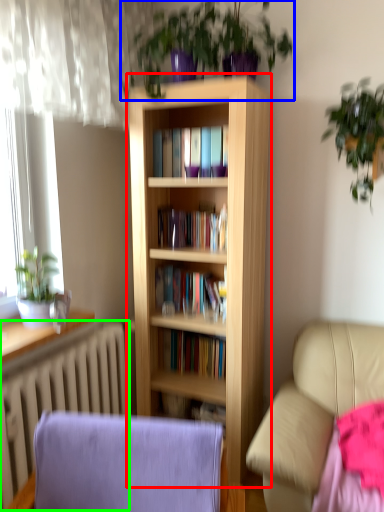
Question: Which is nearer to the bookcase (highlighted by a red box)? houseplant (highlighted by a blue box) or radiator (highlighted by a green box).

Choices:
 (A) houseplant
 (B) radiator

Answer: (A)